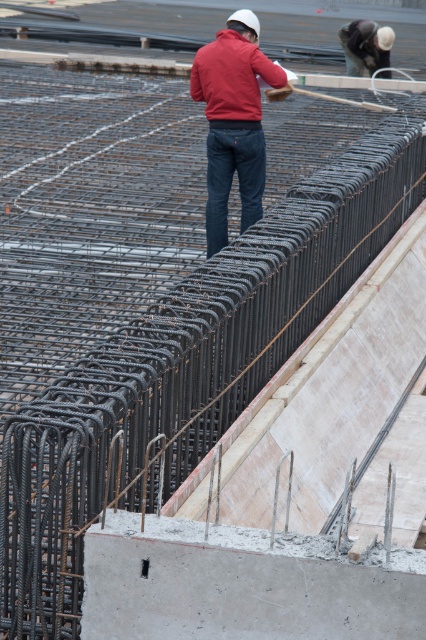
You are a construction inspector standing at the point marked by coordinates point (241, 584). You need to walk to the nearest rebar cage. Which direction should you go?

The gray concrete at lower center is represented by point (241, 584). Since the rebar cages are arranged in parallel rows in the foreground, you should walk forward towards the rebar cages located in front of you.

You are standing at the construction site and want to reach the point marked at coordinates (229, 90). If your current position is 50 feet away from that point, can you walk directly to it without crossing any obstacles?

The point at coordinates (229, 90) is 33.79 feet from the viewer. Since you are currently 50 feet away, you would need to move closer by approximately 16.21 feet to reach it directly. However, the description does not mention any obstacles between your current position and the point, so assuming there are none, you could walk directly to it.

You are a safety inspector at the construction site. You notice the red matte jacket at center and the matte white helmet at upper center. Which object is nearer to you?

The red matte jacket at center is closer to the viewer than the matte white helmet at upper center.